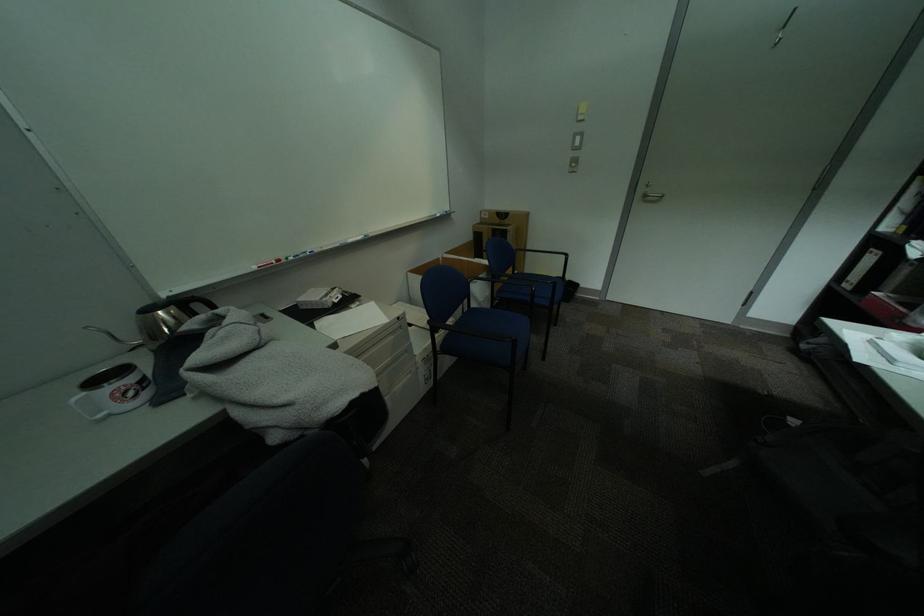
Find the location of a particular element. This screenshot has height=616, width=924. cabinet drawer handle is located at coordinates (426, 374).